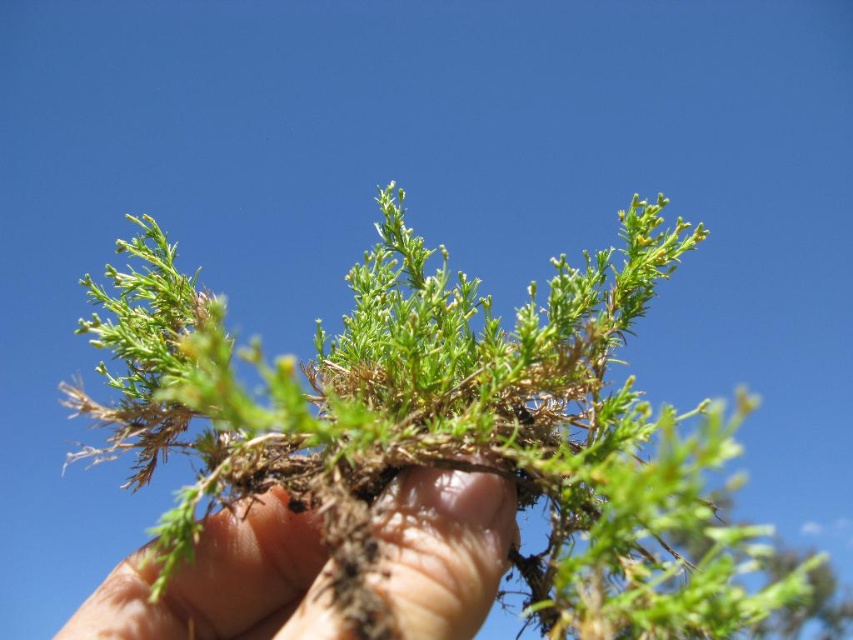
Question: Can you confirm if green fibrous plant at center is thinner than dry soil at center?

Choices:
 (A) yes
 (B) no

Answer: (B)

Question: Which point is farther from the camera taking this photo?

Choices:
 (A) click(x=379, y=257)
 (B) click(x=440, y=573)

Answer: (A)

Question: Which point is closer to the camera taking this photo?

Choices:
 (A) (202, 330)
 (B) (201, 604)

Answer: (A)

Question: Which point is closer to the camera taking this photo?

Choices:
 (A) (318, 604)
 (B) (280, 435)

Answer: (A)

Question: Is green fibrous plant at center to the right of dry soil at center from the viewer's perspective?

Choices:
 (A) yes
 (B) no

Answer: (A)

Question: Is green fibrous plant at center further to the viewer compared to dry soil at center?

Choices:
 (A) yes
 (B) no

Answer: (B)